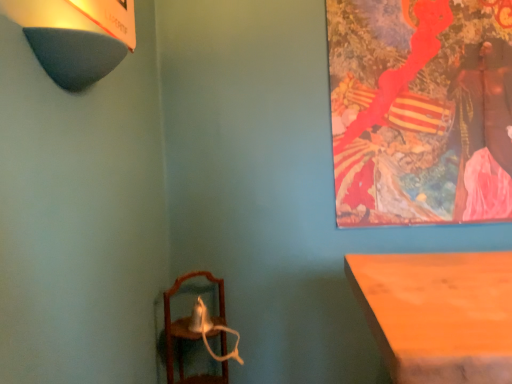
Question: Is dark gray felt lampshade at upper left behind wooden mirror at lower left?

Choices:
 (A) no
 (B) yes

Answer: (A)

Question: From the image's perspective, is dark gray felt lampshade at upper left beneath wooden mirror at lower left?

Choices:
 (A) no
 (B) yes

Answer: (A)

Question: From a real-world perspective, is dark gray felt lampshade at upper left below wooden mirror at lower left?

Choices:
 (A) yes
 (B) no

Answer: (B)

Question: Can you confirm if dark gray felt lampshade at upper left is shorter than wooden mirror at lower left?

Choices:
 (A) yes
 (B) no

Answer: (A)

Question: Is dark gray felt lampshade at upper left next to wooden mirror at lower left?

Choices:
 (A) yes
 (B) no

Answer: (B)

Question: From a real-world perspective, does dark gray felt lampshade at upper left stand above wooden mirror at lower left?

Choices:
 (A) no
 (B) yes

Answer: (B)

Question: Can you confirm if painted canvas at upper right is wider than wooden mirror at lower left?

Choices:
 (A) yes
 (B) no

Answer: (B)

Question: Is the depth of painted canvas at upper right less than that of wooden mirror at lower left?

Choices:
 (A) no
 (B) yes

Answer: (A)

Question: Does painted canvas at upper right appear on the right side of wooden mirror at lower left?

Choices:
 (A) yes
 (B) no

Answer: (A)

Question: Does painted canvas at upper right have a larger size compared to wooden mirror at lower left?

Choices:
 (A) yes
 (B) no

Answer: (B)

Question: Does painted canvas at upper right have a lesser height compared to wooden mirror at lower left?

Choices:
 (A) yes
 (B) no

Answer: (B)

Question: Is painted canvas at upper right at the left side of wooden mirror at lower left?

Choices:
 (A) yes
 (B) no

Answer: (B)

Question: Does painted canvas at upper right come behind dark gray felt lampshade at upper left?

Choices:
 (A) yes
 (B) no

Answer: (A)